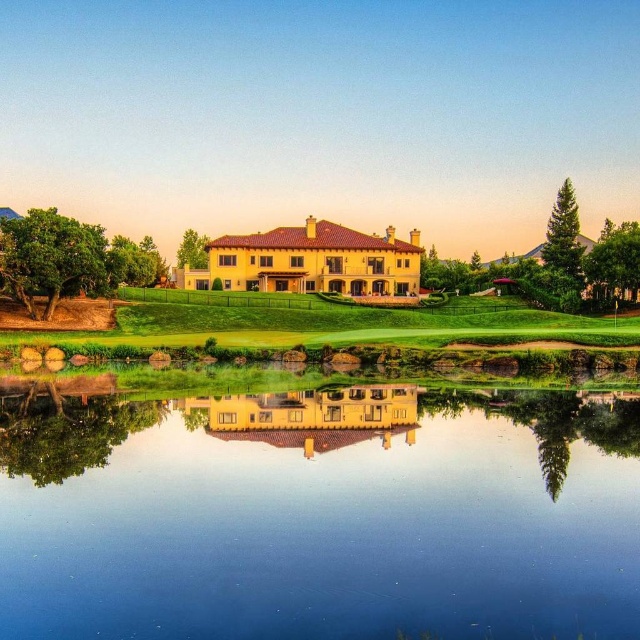
Question: Which object is farther from the camera taking this photo?

Choices:
 (A) transparent glass water at center
 (B) green grass at center

Answer: (B)

Question: Can you confirm if transparent glass water at center is smaller than green grass at center?

Choices:
 (A) yes
 (B) no

Answer: (B)

Question: Which of the following is the farthest from the observer?

Choices:
 (A) (307, 310)
 (B) (588, 468)

Answer: (A)

Question: Does transparent glass water at center lie in front of green grass at center?

Choices:
 (A) no
 (B) yes

Answer: (B)

Question: Does transparent glass water at center have a greater width compared to green grass at center?

Choices:
 (A) no
 (B) yes

Answer: (A)